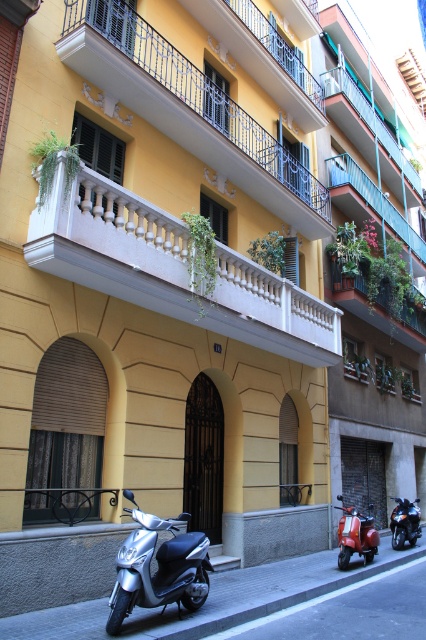
Who is lower down, silver metallic scooter at lower left or blue metal balcony at upper center?

Positioned lower is silver metallic scooter at lower left.

The image size is (426, 640). Find the location of `silver metallic scooter at lower left`. silver metallic scooter at lower left is located at coordinates (158, 566).

Is yellow painted wood balcony at upper center taller than smooth concrete curb at lower center?

Correct, yellow painted wood balcony at upper center is much taller as smooth concrete curb at lower center.

Is point (97, 28) farther from camera compared to point (261, 624)?

Yes.

Is point (256, 173) closer to viewer compared to point (339, 595)?

No, it is behind (339, 595).

Find the location of a particular element. yellow painted wood balcony at upper center is located at coordinates (189, 108).

Who is positioned more to the right, yellow painted wood balcony at upper center or silver metallic scooter at lower left?

yellow painted wood balcony at upper center

Which is behind, point (103, 65) or point (141, 604)?

The point (103, 65) is more distant.

The height and width of the screenshot is (640, 426). What are the coordinates of `yellow painted wood balcony at upper center` in the screenshot? It's located at (x=189, y=108).